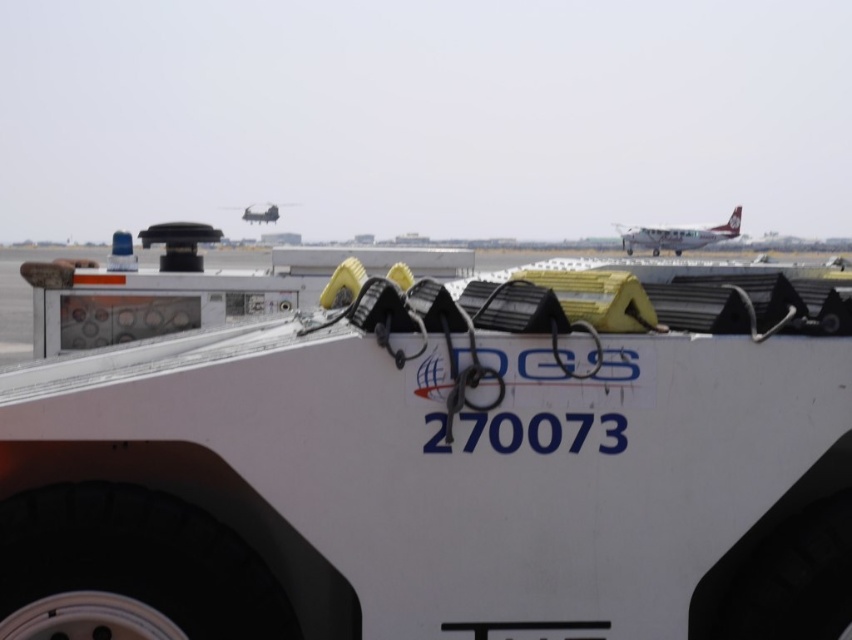
Does white matte trailer truck at center have a smaller size compared to white matte airplane at upper right?

Yes.

Can you confirm if white matte trailer truck at center is positioned below white matte airplane at upper right?

Yes.

The height and width of the screenshot is (640, 852). In order to click on white matte trailer truck at center in this screenshot , I will do `click(430, 454)`.

Can you confirm if white matte airplane at upper right is smaller than metallic silver airplane at upper center?

Actually, white matte airplane at upper right might be larger than metallic silver airplane at upper center.

Looking at this image, between white matte airplane at upper right and metallic silver airplane at upper center, which one is positioned lower?

white matte airplane at upper right

What do you see at coordinates (677, 236) in the screenshot? The height and width of the screenshot is (640, 852). I see `white matte airplane at upper right` at bounding box center [677, 236].

Locate an element on the screen. white matte airplane at upper right is located at coordinates (677, 236).

Which is above, white matte trailer truck at center or metallic silver airplane at upper center?

Positioned higher is metallic silver airplane at upper center.

Is the position of white matte trailer truck at center more distant than that of metallic silver airplane at upper center?

That is False.

Between point (821, 422) and point (248, 209), which one is positioned in front?

Point (821, 422) is more forward.

Identify the location of white matte trailer truck at center. The height and width of the screenshot is (640, 852). (430, 454).